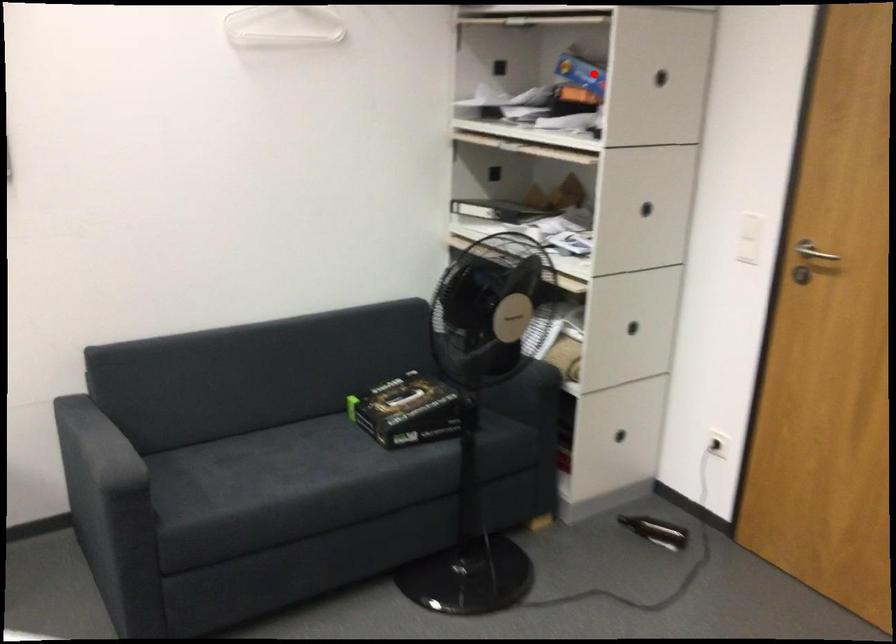
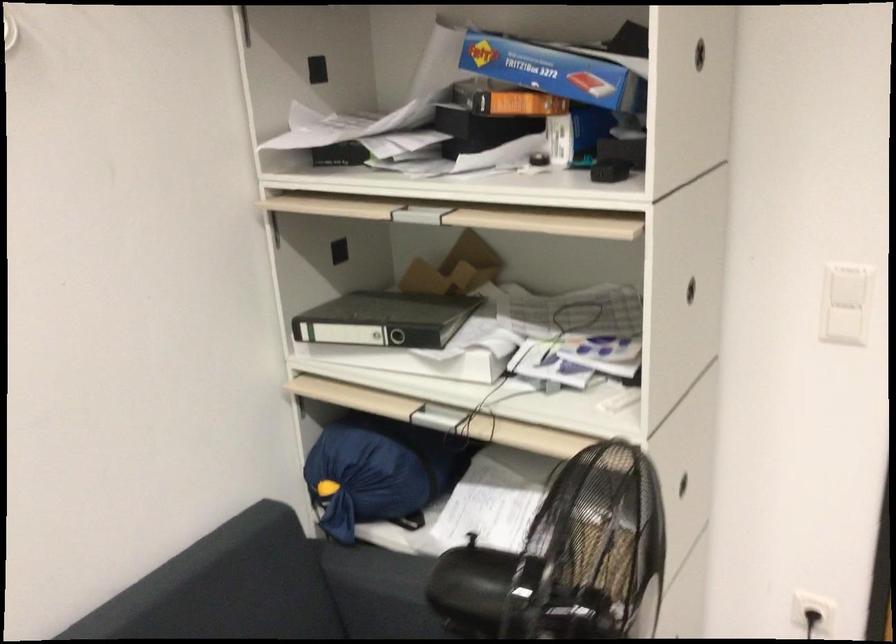
Question: A red point is marked in image1. In image2, is the corresponding 3D point closer to the camera or farther? Reply with the corresponding letter.

Choices:
 (A) The corresponding 3D point is closer.
 (B) The corresponding 3D point is farther.

Answer: (A)